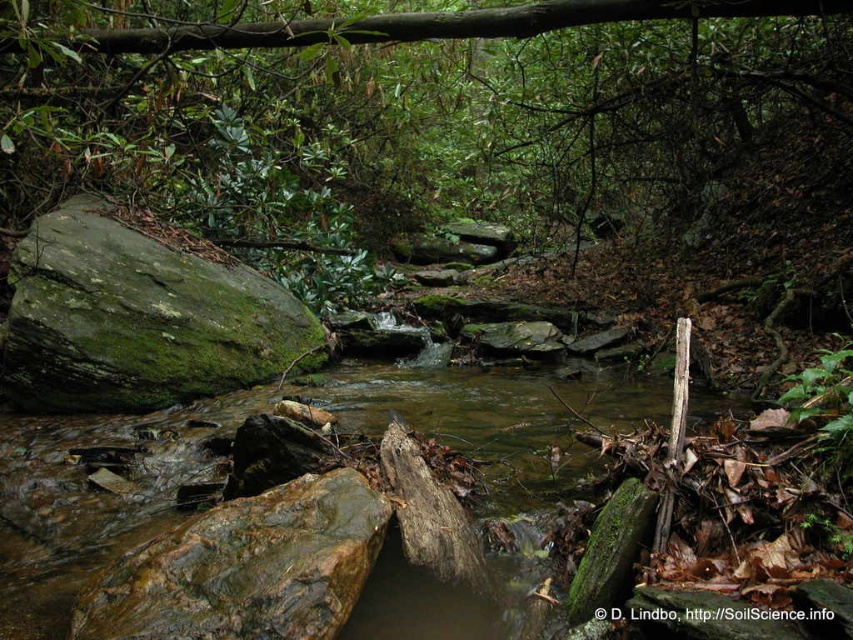
Question: Is brown/mossy rock at center smaller than green mossy rock at center-left?

Choices:
 (A) yes
 (B) no

Answer: (A)

Question: Does brown/mossy rock at center appear over green mossy rock at center-left?

Choices:
 (A) yes
 (B) no

Answer: (B)

Question: Does brown/mossy rock at center appear over green mossy rock at center-left?

Choices:
 (A) yes
 (B) no

Answer: (B)

Question: Which of the following is the closest to the observer?

Choices:
 (A) pos(119,273)
 (B) pos(238,394)

Answer: (A)